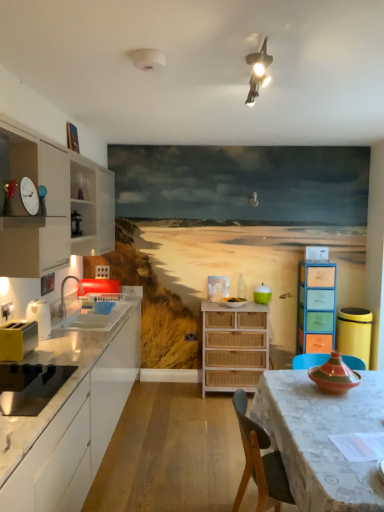
Identify the location of vacant space situated on the left part of multicolored ceramic vase at table, the third appliance ordered from the bottom. (288, 388).